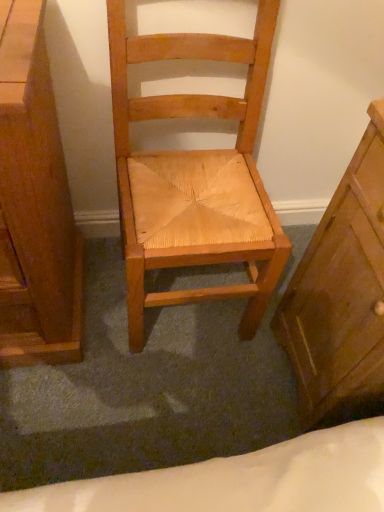
Question: Is wooden chest of drawers at right, which is the 1th chest of drawers from right to left, to the right of wooden chest of drawers at left, marked as the 2th chest of drawers in a right-to-left arrangement, from the viewer's perspective?

Choices:
 (A) yes
 (B) no

Answer: (A)

Question: Is the depth of wooden chest of drawers at right, the second chest of drawers when ordered from left to right, less than that of wooden chest of drawers at left, which is the 1th chest of drawers from left to right?

Choices:
 (A) yes
 (B) no

Answer: (B)

Question: Considering the relative sizes of wooden chest of drawers at right, the second chest of drawers when ordered from left to right, and wooden chest of drawers at left, which is the 1th chest of drawers from left to right, in the image provided, is wooden chest of drawers at right, the second chest of drawers when ordered from left to right, bigger than wooden chest of drawers at left, which is the 1th chest of drawers from left to right,?

Choices:
 (A) no
 (B) yes

Answer: (A)

Question: Can wooden chest of drawers at left, marked as the 2th chest of drawers in a right-to-left arrangement, be found inside wooden chest of drawers at right, which is the 1th chest of drawers from right to left?

Choices:
 (A) no
 (B) yes

Answer: (A)

Question: From a real-world perspective, is wooden chest of drawers at right, the second chest of drawers when ordered from left to right, located beneath wooden chest of drawers at left, marked as the 2th chest of drawers in a right-to-left arrangement?

Choices:
 (A) no
 (B) yes

Answer: (B)

Question: Can you confirm if wooden chest of drawers at right, the second chest of drawers when ordered from left to right, is thinner than wooden chest of drawers at left, which is the 1th chest of drawers from left to right?

Choices:
 (A) yes
 (B) no

Answer: (A)

Question: Is wooden chest of drawers at left, which is the 1th chest of drawers from left to right, wider than natural wood chair at center?

Choices:
 (A) yes
 (B) no

Answer: (A)

Question: Is the position of wooden chest of drawers at left, which is the 1th chest of drawers from left to right, less distant than that of natural wood chair at center?

Choices:
 (A) yes
 (B) no

Answer: (A)

Question: Can you confirm if wooden chest of drawers at left, marked as the 2th chest of drawers in a right-to-left arrangement, is positioned to the left of natural wood chair at center?

Choices:
 (A) no
 (B) yes

Answer: (B)

Question: Is wooden chest of drawers at left, marked as the 2th chest of drawers in a right-to-left arrangement, directly adjacent to natural wood chair at center?

Choices:
 (A) yes
 (B) no

Answer: (B)

Question: From a real-world perspective, is wooden chest of drawers at left, marked as the 2th chest of drawers in a right-to-left arrangement, on natural wood chair at center?

Choices:
 (A) no
 (B) yes

Answer: (A)

Question: Considering the relative sizes of wooden chest of drawers at left, which is the 1th chest of drawers from left to right, and natural wood chair at center in the image provided, is wooden chest of drawers at left, which is the 1th chest of drawers from left to right, shorter than natural wood chair at center?

Choices:
 (A) yes
 (B) no

Answer: (A)

Question: Considering the relative positions of natural wood chair at center and wooden chest of drawers at left, marked as the 2th chest of drawers in a right-to-left arrangement, in the image provided, is natural wood chair at center behind wooden chest of drawers at left, marked as the 2th chest of drawers in a right-to-left arrangement,?

Choices:
 (A) no
 (B) yes

Answer: (B)